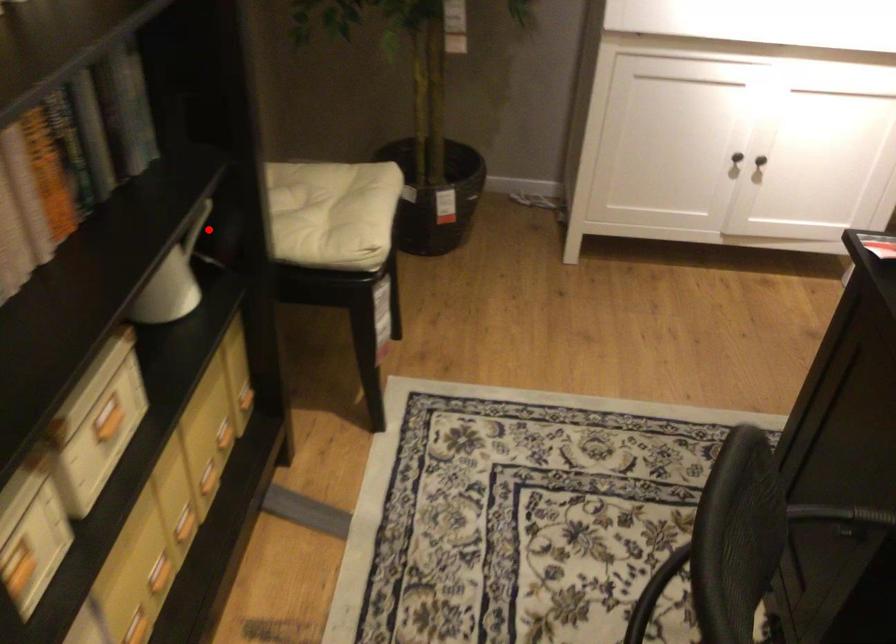
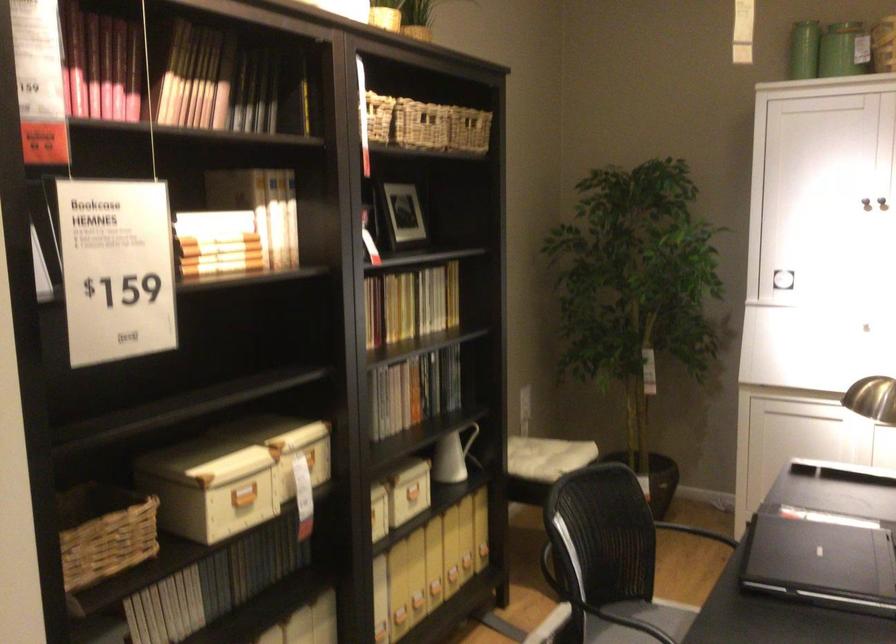
Find the pixel in the second image that matches the highlighted location in the first image.

(474, 444)